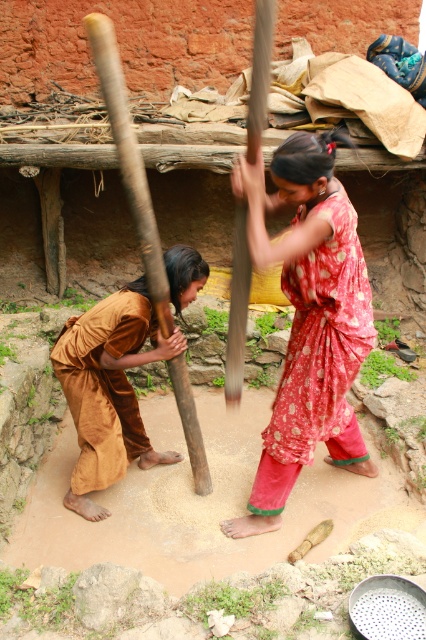
You are a photographer trying to capture both the red printed dress at center and the brown silk robe at lower left in a single frame. Given their sizes, which one will occupy more space horizontally in your photo?

The red printed dress at center will occupy more horizontal space in the photo because its width surpasses that of the brown silk robe at lower left.